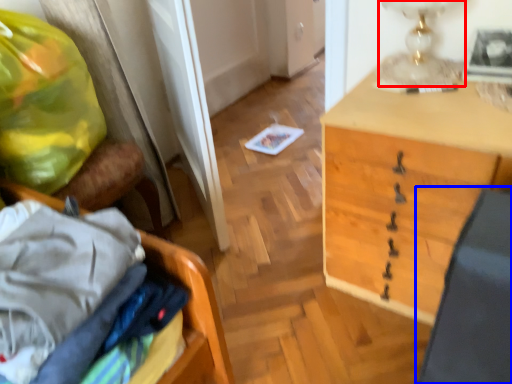
Question: Among these objects, which one is nearest to the camera, table lamp (highlighted by a red box) or swivel chair (highlighted by a blue box)?

Choices:
 (A) table lamp
 (B) swivel chair

Answer: (B)